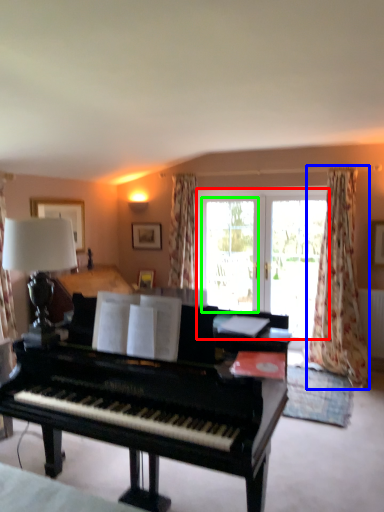
Question: Based on their relative distances, which object is nearer to bay window (highlighted by a red box)? Choose from curtain (highlighted by a blue box) and screen door (highlighted by a green box).

Choices:
 (A) curtain
 (B) screen door

Answer: (B)